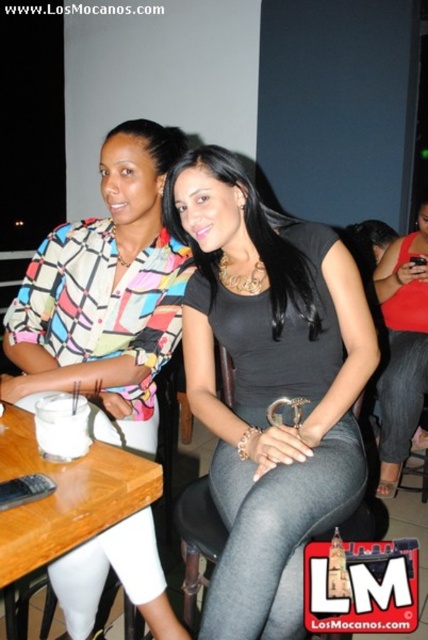
Does black matte dress at center lie in front of white frosted glass at table left?

No, it is not.

Does point (261, 362) come closer to viewer compared to point (80, 451)?

That is False.

This screenshot has height=640, width=428. Identify the location of black matte dress at center. (269, 385).

Can you confirm if black matte dress at center is positioned to the right of white matte cup at center?

Incorrect, black matte dress at center is not on the right side of white matte cup at center.

I want to click on black matte dress at center, so click(x=269, y=385).

The height and width of the screenshot is (640, 428). I want to click on black matte dress at center, so click(269, 385).

Between white frosted glass at table left and white matte cup at center, which one is positioned higher?

white matte cup at center

You are a GUI agent. You are given a task and a screenshot of the screen. Output one action in this format:
    pyautogui.click(x=<x>, y=<y>)
    Task: Click on the white frosted glass at table left
    
    Given the screenshot: What is the action you would take?
    pyautogui.click(x=62, y=426)